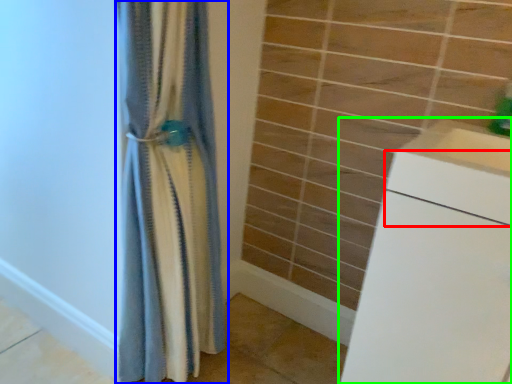
Question: Based on their relative distances, which object is farther from drawer (highlighted by a red box)? Choose from curtain (highlighted by a blue box) and counter (highlighted by a green box).

Choices:
 (A) curtain
 (B) counter

Answer: (A)